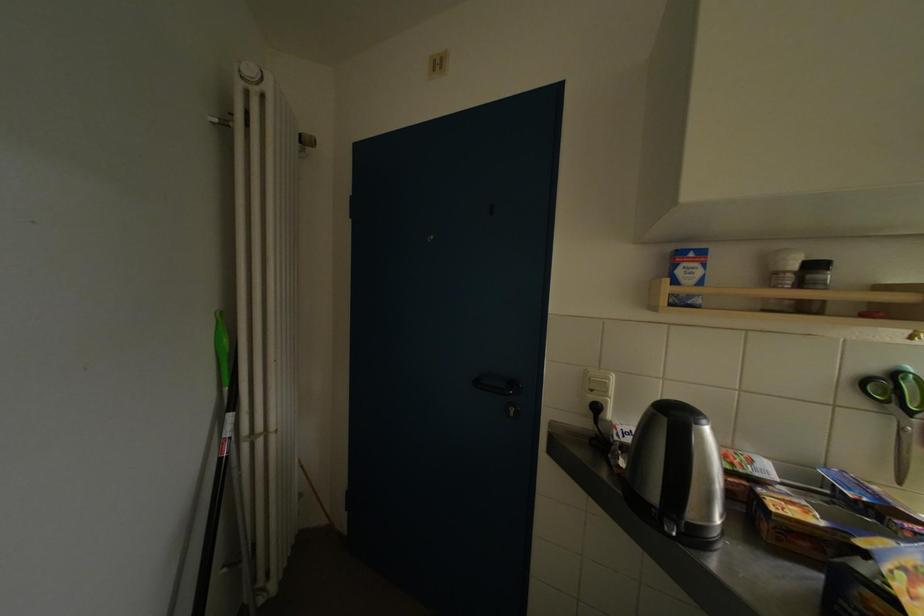
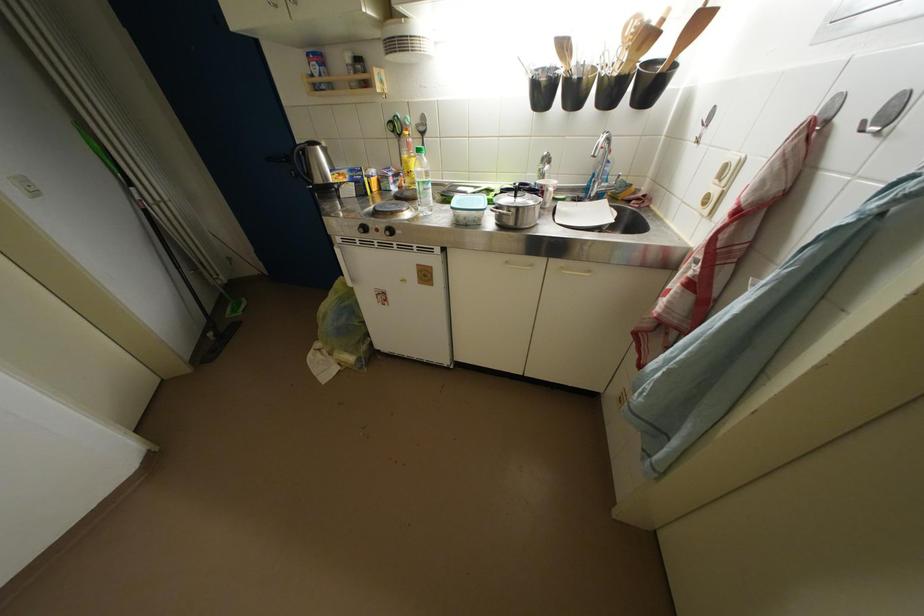
Find the pixel in the second image that matches the point at 235,437 in the first image.

(144, 201)